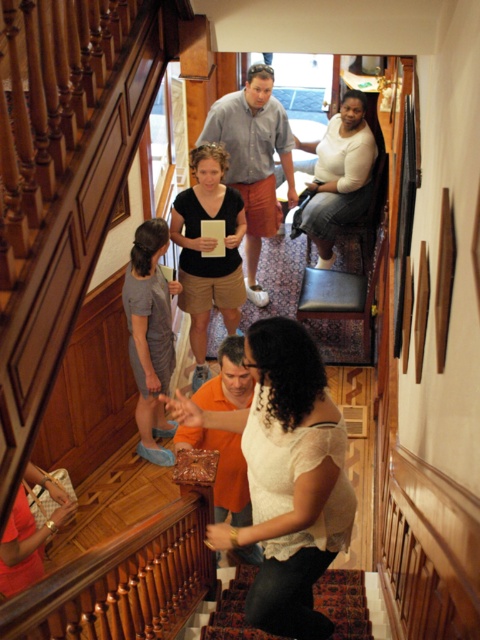
Question: Can you confirm if white lace blouse at center is bigger than white cotton shirt at center?

Choices:
 (A) yes
 (B) no

Answer: (B)

Question: Is white lace blouse at center behind matte black shirt at center?

Choices:
 (A) no
 (B) yes

Answer: (A)

Question: Which is nearer to the matte black shirt at center?

Choices:
 (A) white lace blouse at center
 (B) carpeted stairs at center

Answer: (A)

Question: Which point is closer to the camera?

Choices:
 (A) (218, 572)
 (B) (196, 292)
 (C) (333, 145)

Answer: (A)

Question: Which is nearer to the white cotton shirt at center?

Choices:
 (A) matte black shirt at center
 (B) white lace blouse at center

Answer: (A)

Question: Is white lace blouse at center above matte black shirt at center?

Choices:
 (A) yes
 (B) no

Answer: (B)